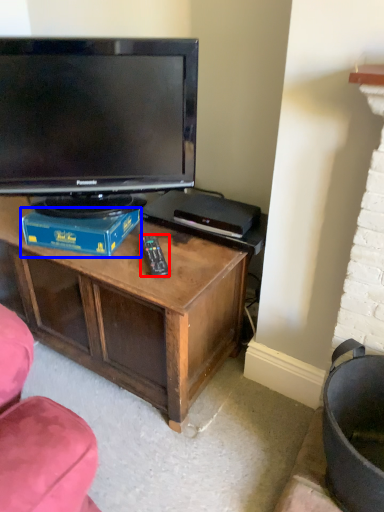
Question: Which of the following is the closest to the observer, remote (highlighted by a red box) or book (highlighted by a blue box)?

Choices:
 (A) remote
 (B) book

Answer: (A)